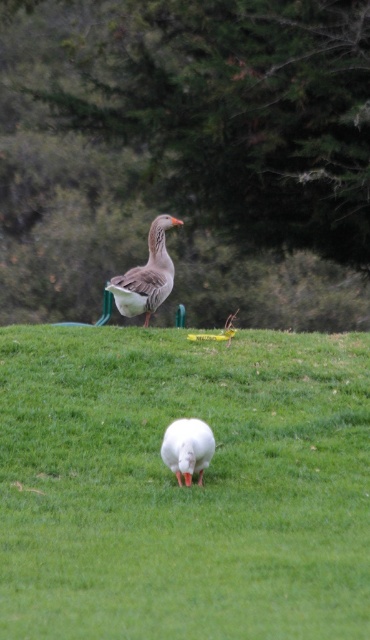
Question: Which object is the farthest from the white matte duck at center?

Choices:
 (A) white grass at center
 (B) gray matte duck at center

Answer: (B)

Question: From the image, what is the correct spatial relationship of white grass at center in relation to white matte duck at center?

Choices:
 (A) above
 (B) below

Answer: (B)

Question: Which of the following is the farthest from the observer?

Choices:
 (A) white matte duck at center
 (B) gray matte duck at center
 (C) white grass at center

Answer: (B)

Question: Does gray matte duck at center appear on the right side of white matte duck at center?

Choices:
 (A) no
 (B) yes

Answer: (A)

Question: Which of these objects is positioned farthest from the white matte duck at center?

Choices:
 (A) white grass at center
 (B) gray matte duck at center

Answer: (B)

Question: Can you confirm if white grass at center is wider than gray matte duck at center?

Choices:
 (A) yes
 (B) no

Answer: (A)